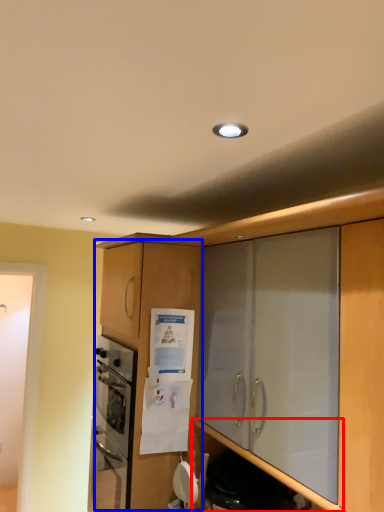
Question: Among these objects, which one is farthest to the camera, shelf (highlighted by a red box) or cabinetry (highlighted by a blue box)?

Choices:
 (A) shelf
 (B) cabinetry

Answer: (B)